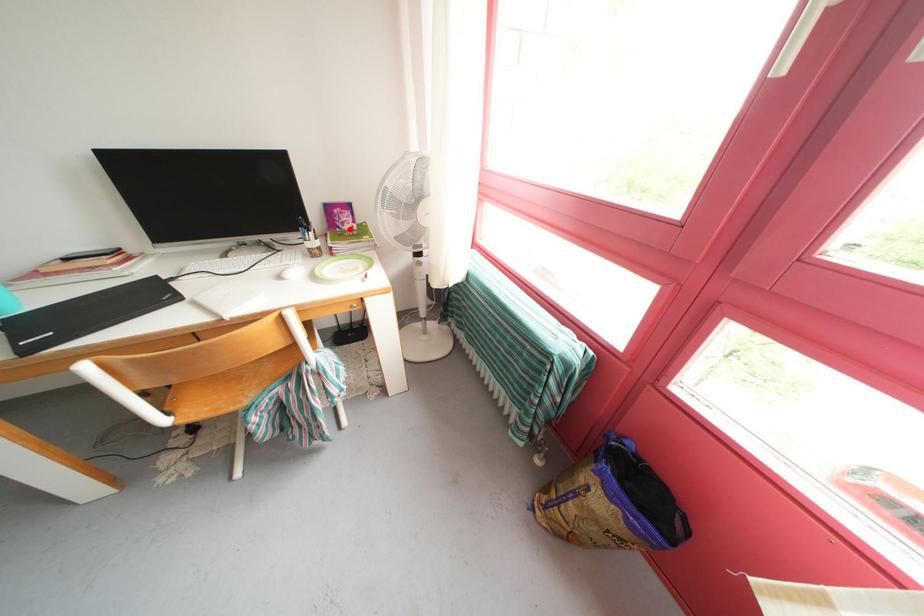
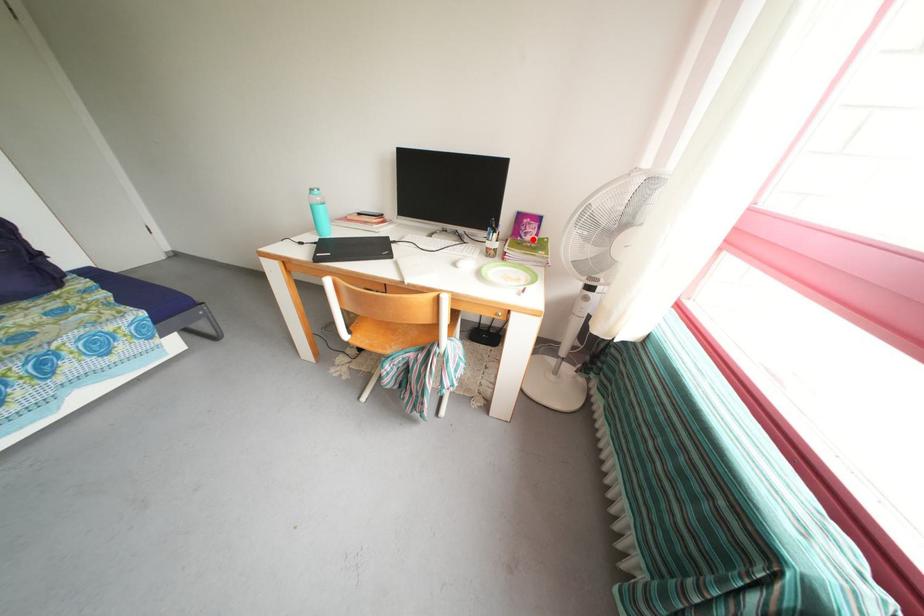
I am providing you with two images of the same scene from different viewpoints. A red point is marked on the first image and another point is marked on the second image. Does the point marked in image1 correspond to the same location as the one in image2?

Yes